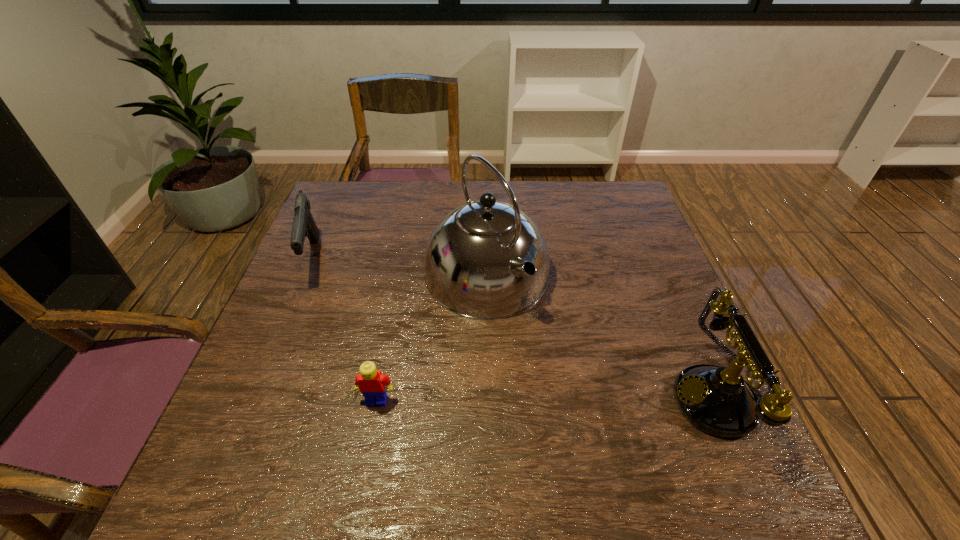
Identify the location of vacant space located on the dial of the rightmost object. This screenshot has height=540, width=960. (608, 398).

The image size is (960, 540). Identify the location of vacant position located 0.290m on the dial of the rightmost object. (527, 398).

This screenshot has height=540, width=960. What are the coordinates of `free space located 0.130m from the spout of the kettle` in the screenshot? It's located at (554, 355).

At what (x,y) coordinates should I click in order to perform the action: click on vacant space located from the spout of the kettle. Please return your answer as a coordinate pair (x, y). The height and width of the screenshot is (540, 960). Looking at the image, I should click on (592, 402).

Where is `blank area located from the spout of the kettle`? blank area located from the spout of the kettle is located at coordinates coord(557,359).

Locate an element on the screen. This screenshot has width=960, height=540. free point located at the muzzle of the gun is located at coordinates (343, 299).

Where is `vacant region located at the muzzle of the gun`? Image resolution: width=960 pixels, height=540 pixels. vacant region located at the muzzle of the gun is located at coordinates (383, 329).

The image size is (960, 540). I want to click on vacant area located at the muzzle of the gun, so click(420, 357).

Where is `Lego located at the near edge`? The height and width of the screenshot is (540, 960). Lego located at the near edge is located at coordinates (371, 383).

The width and height of the screenshot is (960, 540). What are the coordinates of `telephone at the near edge` in the screenshot? It's located at (717, 400).